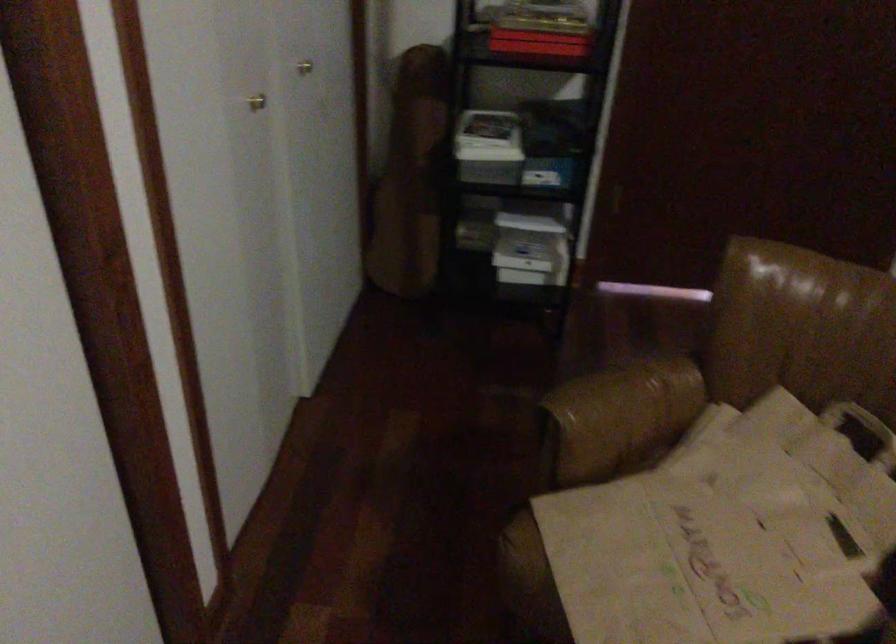
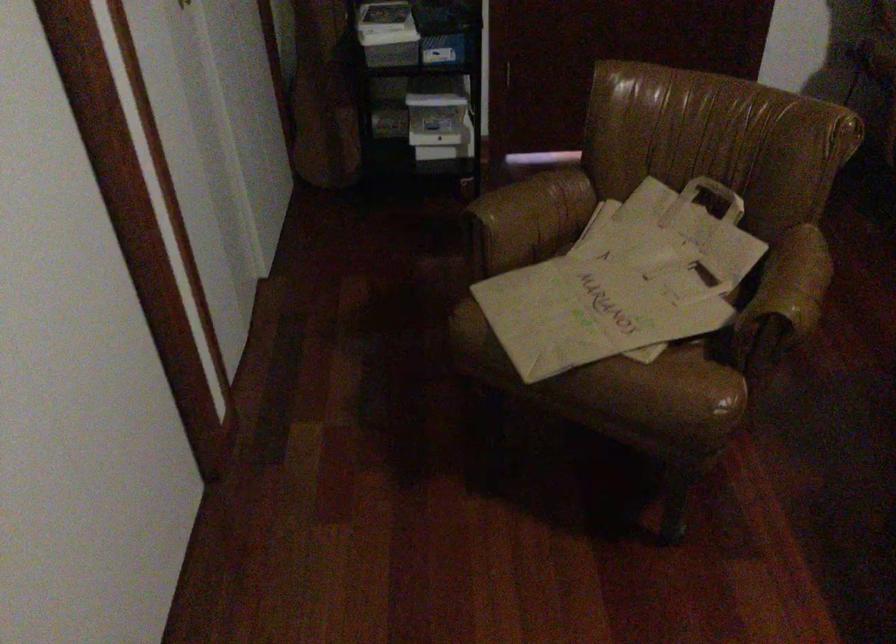
Question: The first image is from the beginning of the video and the second image is from the end. How did the camera likely rotate when shooting the video?

Choices:
 (A) Left
 (B) Right
 (C) Up
 (D) Down

Answer: (B)